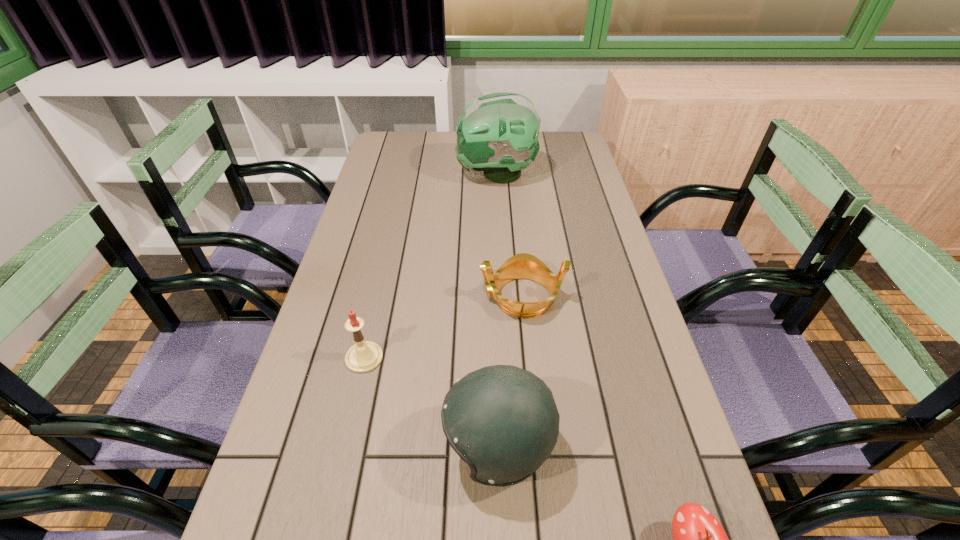
At what (x,y) coordinates should I click in order to perform the action: click on the taller football helmet. Please return your answer as a coordinate pair (x, y). This screenshot has height=540, width=960. Looking at the image, I should click on (497, 133).

Locate an element on the screen. The height and width of the screenshot is (540, 960). the farthest object is located at coordinates (497, 133).

Locate an element on the screen. This screenshot has height=540, width=960. the shorter football helmet is located at coordinates (502, 420).

Locate an element on the screen. The image size is (960, 540). the fourth shortest object is located at coordinates click(x=502, y=420).

Locate an element on the screen. candle is located at coordinates (364, 356).

Where is `the leftmost object`? the leftmost object is located at coordinates (364, 356).

Identify the location of the second farthest object. The width and height of the screenshot is (960, 540). (520, 266).

Identify the location of free location located 0.090m on the visor of the farthest object. The width and height of the screenshot is (960, 540). (430, 174).

Locate an element on the screen. This screenshot has height=540, width=960. vacant region located on the visor of the farthest object is located at coordinates (382, 174).

Where is `vacant space located 0.280m on the visor of the farthest object`? vacant space located 0.280m on the visor of the farthest object is located at coordinates (376, 174).